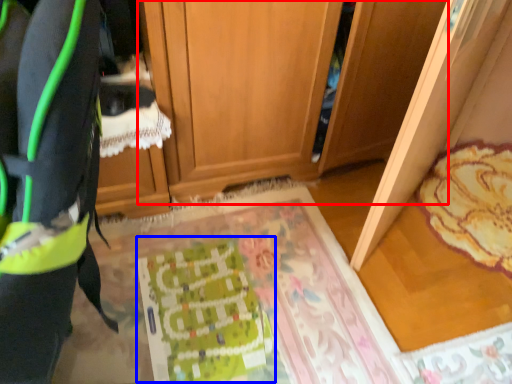
Question: Among these objects, which one is farthest to the camera, cabinetry (highlighted by a red box) or wrapping paper (highlighted by a blue box)?

Choices:
 (A) cabinetry
 (B) wrapping paper

Answer: (B)